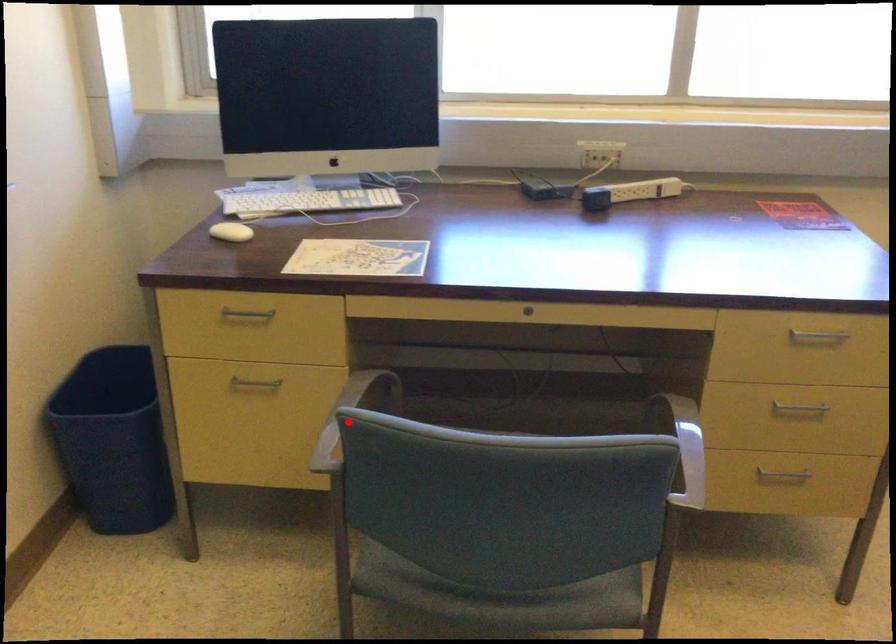
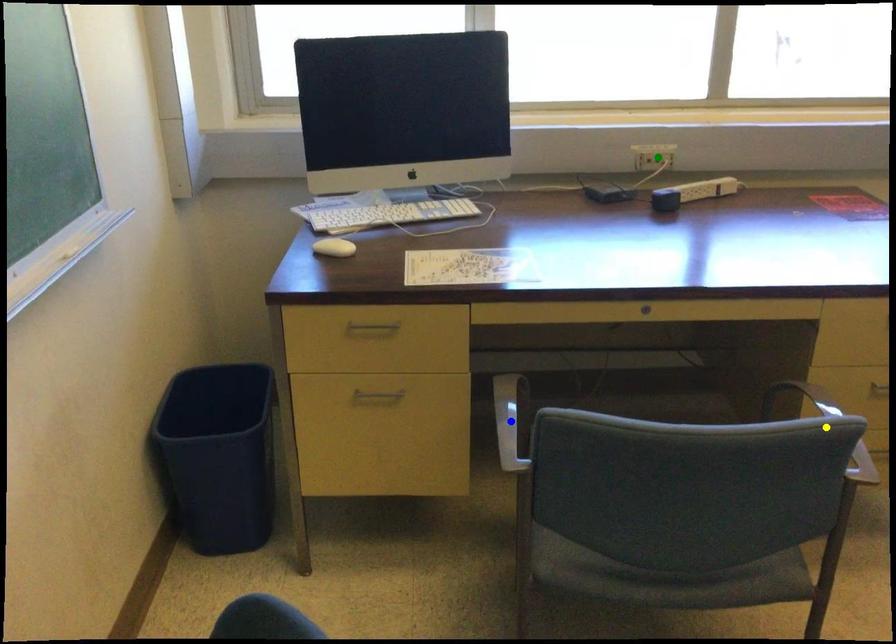
Question: I am providing you with two images of the same scene from different viewpoints. A red point is marked on the first image. You are given multiple points on the second image. Which point in image 2 is actually the same real-world point as the red point in image 1?

Choices:
 (A) yellow point
 (B) blue point
 (C) green point

Answer: (B)